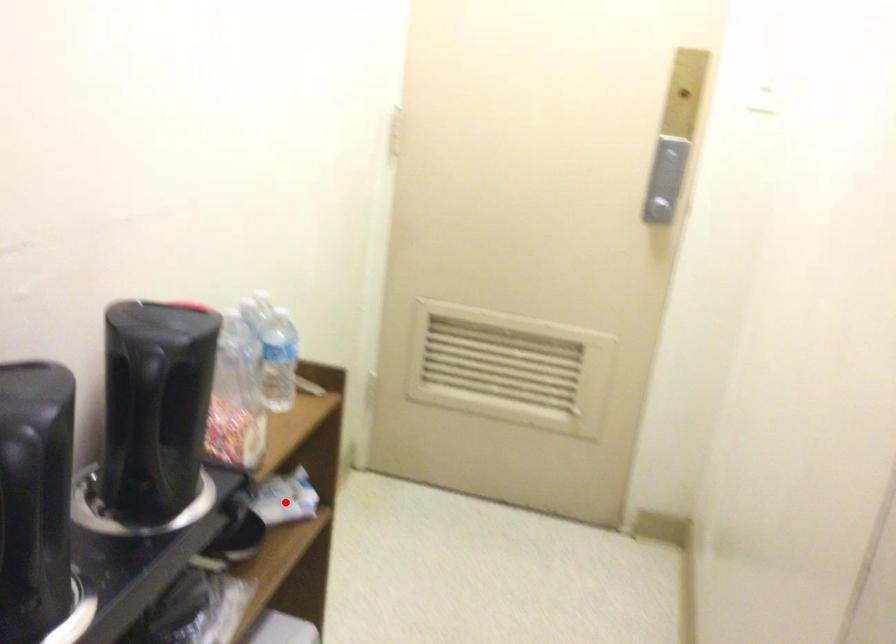
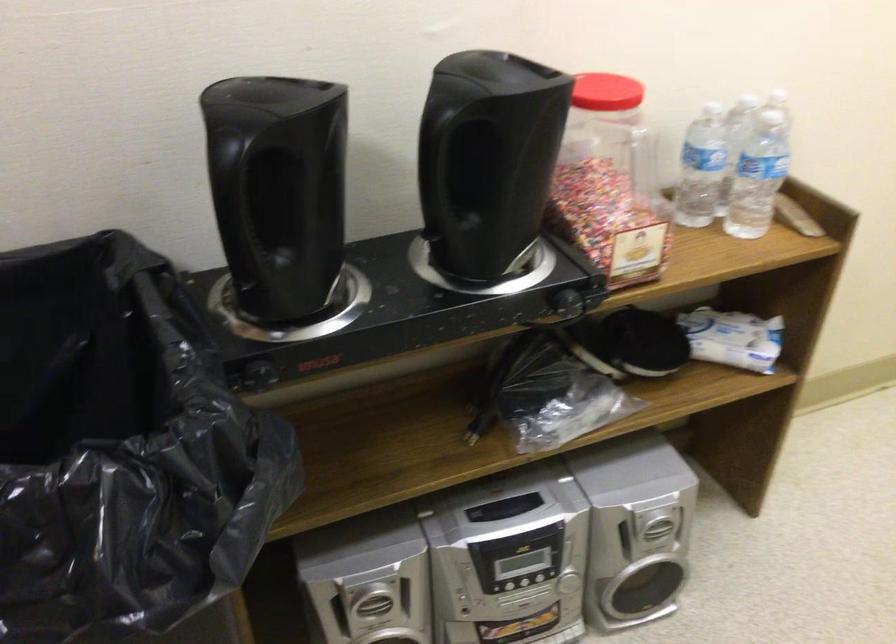
The point at the highlighted location is marked in the first image. Where is the corresponding point in the second image?

(733, 337)